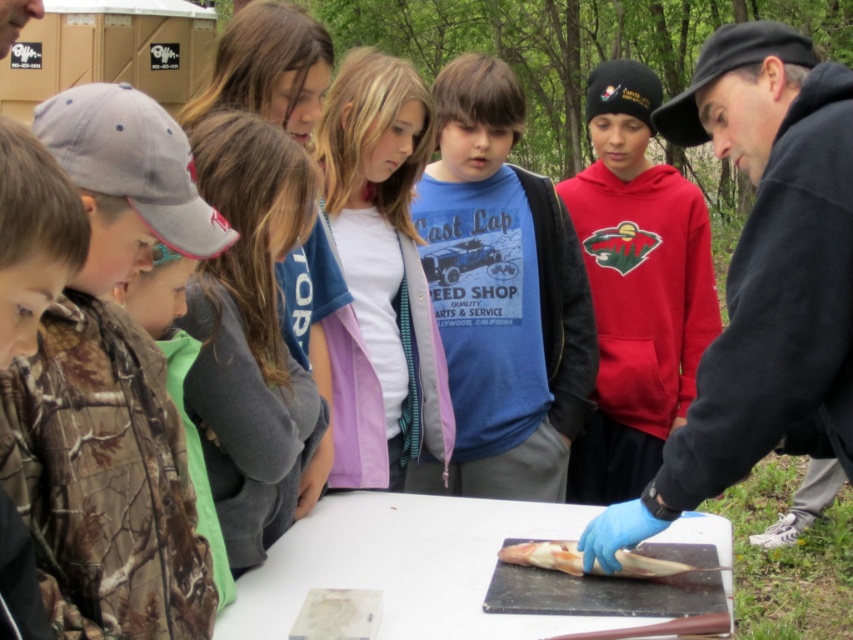
Question: Which point is closer to the camera taking this photo?

Choices:
 (A) (49, 198)
 (B) (447, 216)
 (C) (558, 554)

Answer: (A)

Question: Which point is closer to the camera?

Choices:
 (A) (271, 324)
 (B) (612, 182)
 (C) (450, 189)

Answer: (A)

Question: Considering the relative positions of pink fabric jacket at center and camo fabric shirt at left in the image provided, where is pink fabric jacket at center located with respect to camo fabric shirt at left?

Choices:
 (A) above
 (B) below

Answer: (A)

Question: Which point is farther to the camera?

Choices:
 (A) (155, 163)
 (B) (53, 177)
 (C) (691, 349)
 (D) (213, 444)

Answer: (C)

Question: Can you confirm if blue cotton shirt at center is positioned to the left of camouflage fabric shirt at left?

Choices:
 (A) yes
 (B) no

Answer: (B)

Question: Does blue cotton shirt at center come in front of white matte table at center?

Choices:
 (A) yes
 (B) no

Answer: (B)